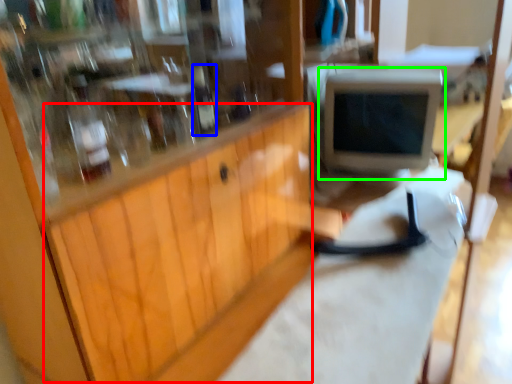
Question: Which object is the farthest from wood (highlighted by a red box)? Choose among these: bottle (highlighted by a blue box) or computer monitor (highlighted by a green box).

Choices:
 (A) bottle
 (B) computer monitor

Answer: (B)